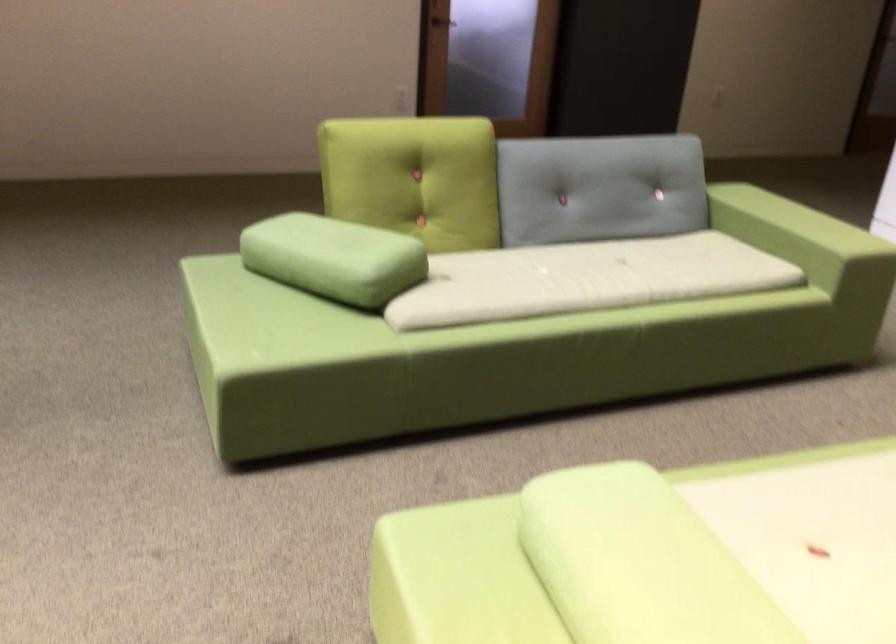
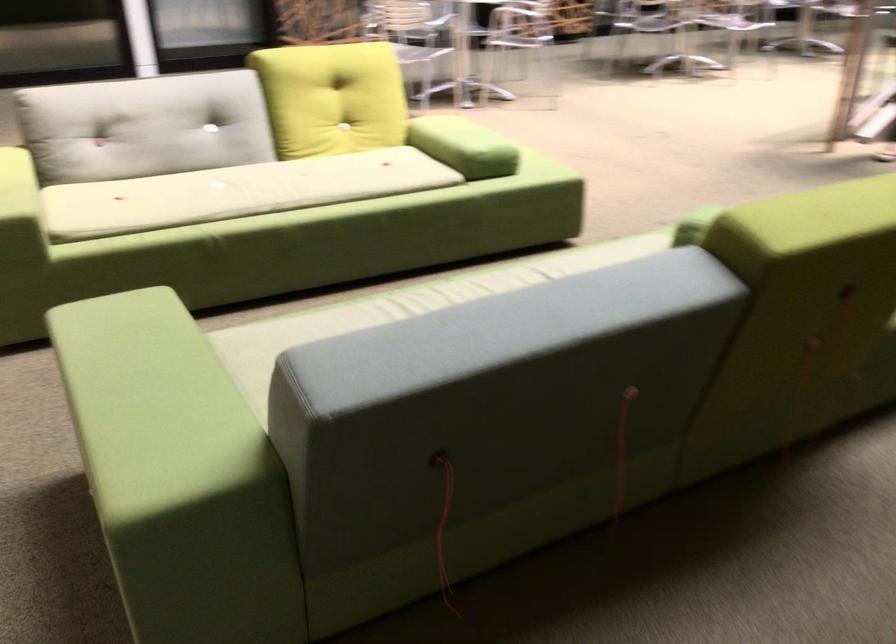
The point at (661, 270) is marked in the first image. Where is the corresponding point in the second image?

(401, 308)